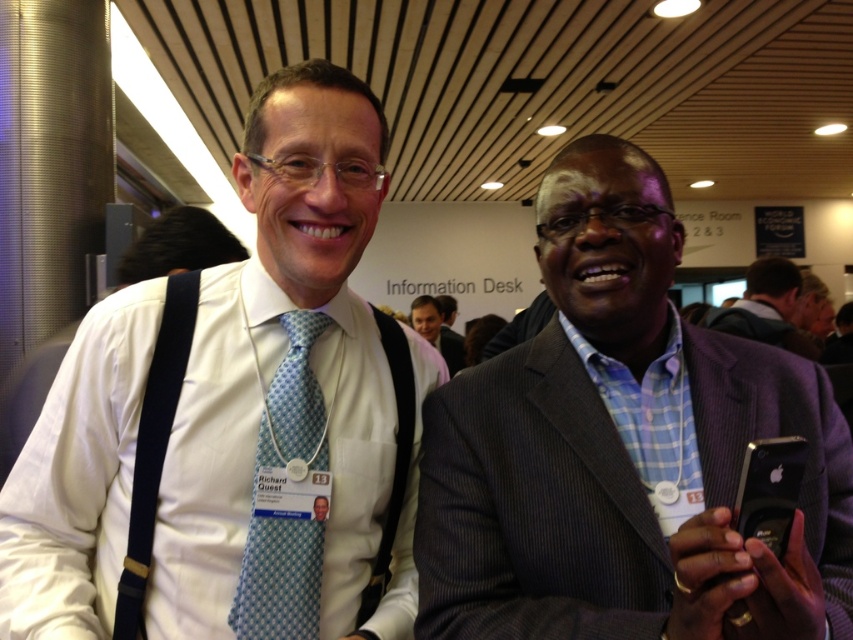
Question: Can you confirm if gray pinstripe suit at center is positioned below blue dotted tie at center?

Choices:
 (A) yes
 (B) no

Answer: (B)

Question: Based on their relative distances, which object is farther from the gray fabric jacket at right?

Choices:
 (A) gray pinstripe suit at center
 (B) white shirt at left
 (C) blue dotted tie at center

Answer: (C)

Question: Does blue dotted tie at center have a smaller size compared to gray fabric jacket at right?

Choices:
 (A) yes
 (B) no

Answer: (A)

Question: Which object is positioned farthest from the white shirt at left?

Choices:
 (A) gray fabric jacket at right
 (B) blue dotted tie at center

Answer: (A)

Question: Can you confirm if white shirt at left is thinner than gray fabric jacket at right?

Choices:
 (A) no
 (B) yes

Answer: (B)

Question: Among these objects, which one is farthest from the camera?

Choices:
 (A) gray fabric jacket at right
 (B) white shirt at left
 (C) blue dotted tie at center
 (D) gray pinstripe suit at center

Answer: (A)